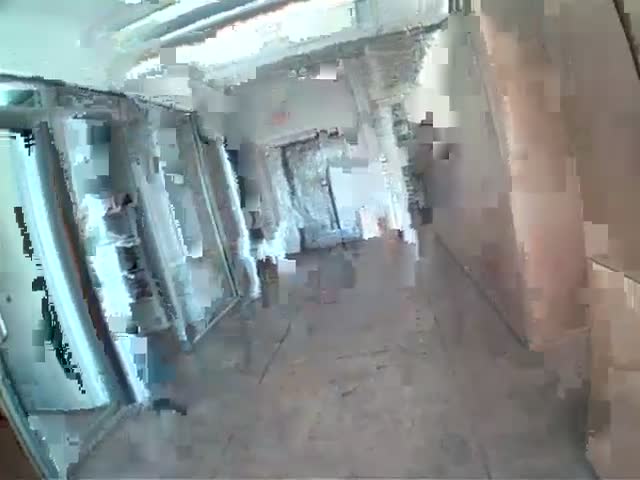
This screenshot has height=480, width=640. Find the location of `white ceiling`. white ceiling is located at coordinates (81, 38), (379, 16).